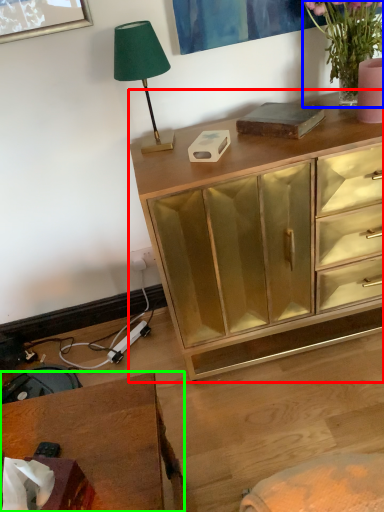
Question: Which object is the closest to the chest of drawers (highlighted by a red box)? Choose among these: houseplant (highlighted by a blue box) or desk (highlighted by a green box).

Choices:
 (A) houseplant
 (B) desk

Answer: (A)